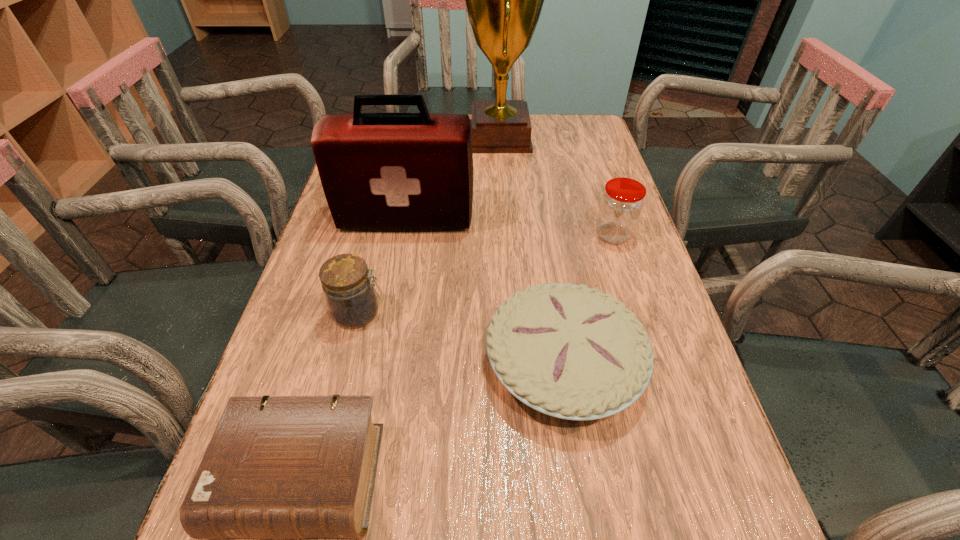
The height and width of the screenshot is (540, 960). Find the location of `free location that satisfies the following two spatial constraints: 1. on the side of the fifth shortest object with the cross symbol; 2. on the lid of the left jar`. free location that satisfies the following two spatial constraints: 1. on the side of the fifth shortest object with the cross symbol; 2. on the lid of the left jar is located at coordinates (389, 313).